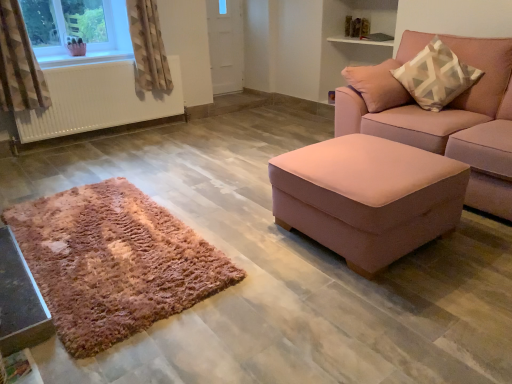
What do you see at coordinates (368, 197) in the screenshot? I see `pink fabric ottoman at right, which ranks as the second table in left-to-right order` at bounding box center [368, 197].

What do you see at coordinates (19, 64) in the screenshot?
I see `geometric patterned fabric curtain at upper left, placed as the 2th curtain when sorted from back to front` at bounding box center [19, 64].

What do you see at coordinates (77, 30) in the screenshot? I see `white plastic window at upper left` at bounding box center [77, 30].

Describe the element at coordinates (225, 45) in the screenshot. I see `white matte door at upper center` at that location.

Locate an element on the screen. This screenshot has width=512, height=384. pink fabric ottoman at right, which ranks as the second table in left-to-right order is located at coordinates (368, 197).

Can you confirm if shiny black table at lower left, which appears as the second table when viewed from the right, is wider than shaggy pink rug at lower left?

Indeed, shiny black table at lower left, which appears as the second table when viewed from the right, has a greater width compared to shaggy pink rug at lower left.

From a real-world perspective, between shiny black table at lower left, which appears as the second table when viewed from the right, and shaggy pink rug at lower left, who is vertically lower?

shaggy pink rug at lower left is physically lower.

Which is less distant, (x=10, y=312) or (x=205, y=287)?

Point (x=10, y=312) appears to be closer to the viewer than point (x=205, y=287).

In terms of size, does shiny black table at lower left, placed as the 1th table when sorted from left to right, appear bigger or smaller than shaggy pink rug at lower left?

Clearly, shiny black table at lower left, placed as the 1th table when sorted from left to right, is smaller in size than shaggy pink rug at lower left.

Is point (42, 205) farther from viewer compared to point (226, 60)?

No, it is in front of (226, 60).

Where is `screen door that is above the shaggy pink rug at lower left (from a real-world perspective)`? The width and height of the screenshot is (512, 384). screen door that is above the shaggy pink rug at lower left (from a real-world perspective) is located at coordinates (225, 45).

Is shaggy pink rug at lower left far from white matte door at upper center?

Indeed, shaggy pink rug at lower left is not near white matte door at upper center.

Is geometric patterned fabric curtain at upper left, the first curtain in the front-to-back sequence, next to white matte door at upper center and touching it?

geometric patterned fabric curtain at upper left, the first curtain in the front-to-back sequence, is not next to white matte door at upper center, and they're not touching.

Considering the points (12, 41) and (223, 0), which point is in front, point (12, 41) or point (223, 0)?

The point (12, 41) is closer to the camera.

Is geometric patterned fabric curtain at upper left, which is the 2th curtain in right-to-left order, facing away from white matte door at upper center?

No, geometric patterned fabric curtain at upper left, which is the 2th curtain in right-to-left order, is not facing the opposite direction of white matte door at upper center.

Is white plastic window at upper left positioned behind pink fabric ottoman at right, which is the first table from right to left?

Yes, white plastic window at upper left is further from the viewer.

Is white plastic window at upper left placed right next to pink fabric ottoman at right, which is the first table from right to left?

They are not placed beside each other.

Can you confirm if white plastic window at upper left is positioned to the right of pink fabric ottoman at right, which is the first table from right to left?

Incorrect, white plastic window at upper left is not on the right side of pink fabric ottoman at right, which is the first table from right to left.

Is beige textured curtain at upper left, which is the 2th curtain in front-to-back order, beside shaggy pink rug at lower left?

beige textured curtain at upper left, which is the 2th curtain in front-to-back order, is not next to shaggy pink rug at lower left, and they're not touching.

Is beige textured curtain at upper left, the first curtain viewed from the back, inside or outside of shaggy pink rug at lower left?

The correct answer is: outside.

Between beige textured curtain at upper left, the first curtain viewed from the back, and shaggy pink rug at lower left, which one has more height?

Standing taller between the two is beige textured curtain at upper left, the first curtain viewed from the back.

From a real-world perspective, which is physically above, beige textured curtain at upper left, which is counted as the 2th curtain, starting from the left, or shaggy pink rug at lower left?

beige textured curtain at upper left, which is counted as the 2th curtain, starting from the left, is physically above.

Considering their positions, is pink fabric couch at right located in front of or behind geometric-patterned fabric pillow at upper right?

pink fabric couch at right is positioned closer to the viewer than geometric-patterned fabric pillow at upper right.

From a real-world perspective, which object rests below the other?

pink fabric couch at right.

Which is correct: pink fabric couch at right is inside geometric-patterned fabric pillow at upper right, or outside of it?

pink fabric couch at right exists outside the volume of geometric-patterned fabric pillow at upper right.

Does geometric patterned fabric curtain at upper left, the 1th curtain when ordered from left to right, touch shaggy pink rug at lower left?

They are not placed beside each other.

Which is closer, (22, 66) or (74, 224)?

The point (74, 224) is in front.

From a real-world perspective, which is physically above, geometric patterned fabric curtain at upper left, the 1th curtain when ordered from left to right, or shaggy pink rug at lower left?

From a 3D spatial view, geometric patterned fabric curtain at upper left, the 1th curtain when ordered from left to right, is above.

Is geometric patterned fabric curtain at upper left, the 1th curtain when ordered from left to right, taller or shorter than shaggy pink rug at lower left?

In the image, geometric patterned fabric curtain at upper left, the 1th curtain when ordered from left to right, appears to be taller than shaggy pink rug at lower left.

You are a GUI agent. You are given a task and a screenshot of the screen. Output one action in this format:
    pyautogui.click(x=<x>, y=<y>)
    Task: Click on the table below the shaggy pink rug at lower left (from the image's perspective)
    This screenshot has height=384, width=512.
    Given the screenshot: What is the action you would take?
    pyautogui.click(x=20, y=301)

Image resolution: width=512 pixels, height=384 pixels. What are the coordinates of `screen door that is behind the shaggy pink rug at lower left` in the screenshot? It's located at (225, 45).

Estimate the real-world distances between objects in this image. Which object is closer to white matte radiator at left, geometric patterned fabric curtain at upper left, placed as the 2th curtain when sorted from back to front, or white matte door at upper center?

geometric patterned fabric curtain at upper left, placed as the 2th curtain when sorted from back to front, lies closer to white matte radiator at left than the other object.

When comparing their distances from pink fabric ottoman at right, which is the first table from right to left, does geometric-patterned fabric pillow at upper right or shiny black table at lower left, which appears as the second table when viewed from the right, seem closer?

geometric-patterned fabric pillow at upper right.

Based on their spatial positions, is geometric patterned fabric curtain at upper left, placed as the 2th curtain when sorted from back to front, or geometric-patterned fabric pillow at upper right further from white plastic window at upper left?

geometric-patterned fabric pillow at upper right.

Looking at the image, which one is located closer to shiny black table at lower left, which appears as the second table when viewed from the right, pink fabric ottoman at right, which ranks as the second table in left-to-right order, or white matte door at upper center?

pink fabric ottoman at right, which ranks as the second table in left-to-right order.

Estimate the real-world distances between objects in this image. Which object is further from pink fabric ottoman at right, which ranks as the second table in left-to-right order, beige textured curtain at upper left, the first curtain viewed from the back, or pink fabric couch at right?

Based on the image, beige textured curtain at upper left, the first curtain viewed from the back, appears to be further to pink fabric ottoman at right, which ranks as the second table in left-to-right order.

Which object lies further to the anchor point shaggy pink rug at lower left, white matte radiator at left or geometric-patterned fabric pillow at upper right?

Based on the image, geometric-patterned fabric pillow at upper right appears to be further to shaggy pink rug at lower left.

When comparing their distances from geometric patterned fabric curtain at upper left, which is the 2th curtain in right-to-left order, does beige textured curtain at upper left, the first curtain viewed from the back, or white plastic window at upper left seem closer?

Among the two, white plastic window at upper left is located nearer to geometric patterned fabric curtain at upper left, which is the 2th curtain in right-to-left order.

From the image, which object appears to be farther from geometric patterned fabric curtain at upper left, placed as the 2th curtain when sorted from back to front, white matte radiator at left or shaggy pink rug at lower left?

Among the two, shaggy pink rug at lower left is located further to geometric patterned fabric curtain at upper left, placed as the 2th curtain when sorted from back to front.

I want to click on radiator between white plastic window at upper left and beige textured curtain at upper left, which is the 1th curtain from right to left, from left to right, so click(x=97, y=100).

Find the location of a particular element. curtain situated between white plastic window at upper left and pink fabric ottoman at right, which is the first table from right to left, from left to right is located at coordinates (148, 46).

Where is `table between shaggy pink rug at lower left and geometric-patterned fabric pillow at upper right`? The image size is (512, 384). table between shaggy pink rug at lower left and geometric-patterned fabric pillow at upper right is located at coordinates (368, 197).

I want to click on curtain located between shiny black table at lower left, placed as the 1th table when sorted from left to right, and geometric-patterned fabric pillow at upper right in the left-right direction, so click(x=148, y=46).